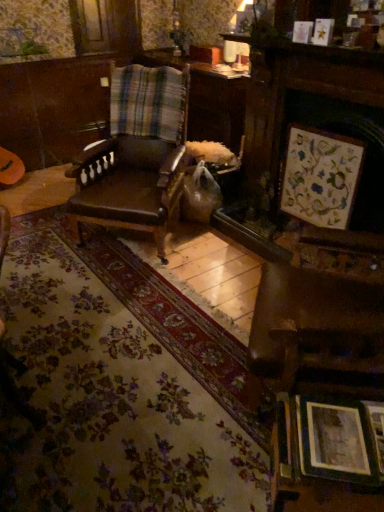
Question: Should I look upward or downward to see wooden picture frame at upper right, arranged as the second picture frame when viewed from the top?

Choices:
 (A) up
 (B) down

Answer: (A)

Question: Is matte silver picture frame at lower right, which is the 2th picture frame from front to back, to the left of wooden framed artwork at upper right, which is counted as the 3th picture frame, starting from the bottom, from the viewer's perspective?

Choices:
 (A) yes
 (B) no

Answer: (A)

Question: Does matte silver picture frame at lower right, the fourth picture frame positioned from the top, turn towards wooden framed artwork at upper right, which is the 3th picture frame in top-to-bottom order?

Choices:
 (A) yes
 (B) no

Answer: (B)

Question: Would you consider matte silver picture frame at lower right, which is counted as the fourth picture frame, starting from the back, to be distant from wooden framed artwork at upper right, which is the 3th picture frame in top-to-bottom order?

Choices:
 (A) no
 (B) yes

Answer: (B)

Question: From a real-world perspective, is matte silver picture frame at lower right, the second picture frame when ordered from bottom to top, physically above wooden framed artwork at upper right, marked as the third picture frame in a front-to-back arrangement?

Choices:
 (A) yes
 (B) no

Answer: (B)

Question: Considering the relative sizes of matte silver picture frame at lower right, which is the 2th picture frame from front to back, and wooden framed artwork at upper right, which is counted as the 3th picture frame, starting from the bottom, in the image provided, is matte silver picture frame at lower right, which is the 2th picture frame from front to back, smaller than wooden framed artwork at upper right, which is counted as the 3th picture frame, starting from the bottom,?

Choices:
 (A) no
 (B) yes

Answer: (B)

Question: Does matte silver picture frame at lower right, the second picture frame when ordered from bottom to top, have a lesser height compared to wooden framed artwork at upper right, which is counted as the 3th picture frame, starting from the bottom?

Choices:
 (A) no
 (B) yes

Answer: (B)

Question: Is wooden picture frame at upper center, the 1th picture frame from the back, thinner than brown leather chair at center?

Choices:
 (A) no
 (B) yes

Answer: (B)

Question: Can you confirm if wooden picture frame at upper center, the 1th picture frame from the back, is positioned to the left of brown leather chair at center?

Choices:
 (A) no
 (B) yes

Answer: (A)

Question: Is wooden picture frame at upper center, which is the first picture frame from top to bottom, oriented towards brown leather chair at center?

Choices:
 (A) yes
 (B) no

Answer: (B)

Question: Is there a large distance between wooden picture frame at upper center, the 1th picture frame from the back, and brown leather chair at center?

Choices:
 (A) yes
 (B) no

Answer: (A)

Question: Can you confirm if wooden picture frame at upper center, the 1th picture frame from the back, is shorter than brown leather chair at center?

Choices:
 (A) no
 (B) yes

Answer: (B)

Question: Does wooden picture frame at upper center, which is the first picture frame from top to bottom, have a greater height compared to brown leather chair at center?

Choices:
 (A) no
 (B) yes

Answer: (A)

Question: From the image's perspective, does wooden picture frame at lower right, the 5th picture frame positioned from the top, appear higher than plaid fabric at center?

Choices:
 (A) yes
 (B) no

Answer: (B)